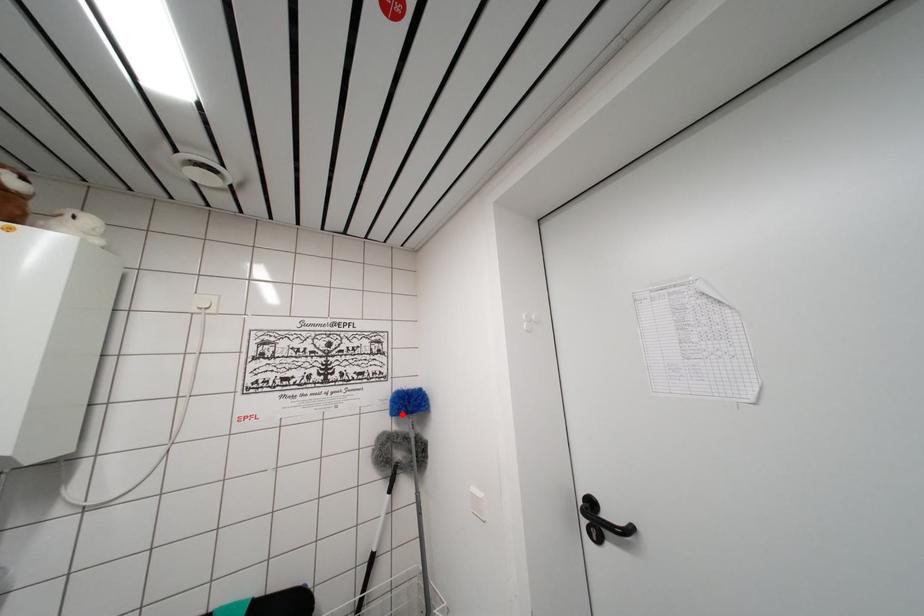
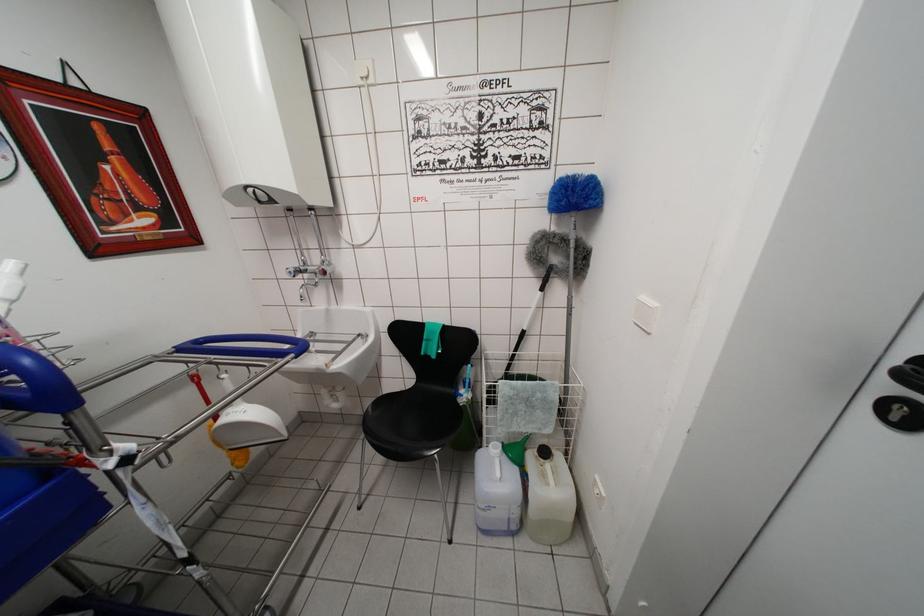
Question: A red point is marked in image1. In image2, is the corresponding 3D point closer to the camera or farther? Reply with the corresponding letter.

Choices:
 (A) The corresponding 3D point is closer.
 (B) The corresponding 3D point is farther.

Answer: (A)